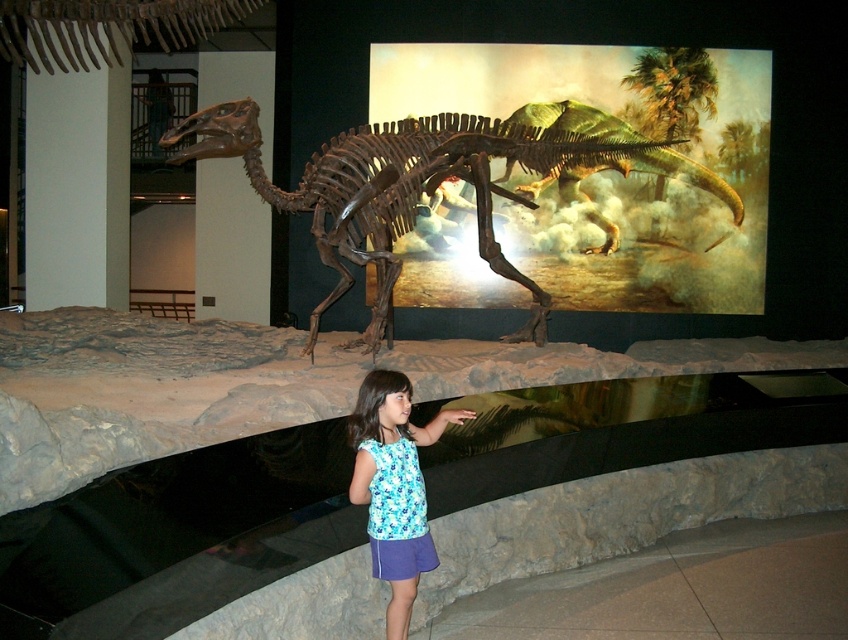
Can you confirm if brown bone at center is thinner than blue printed tank top at center?

No.

Which is below, brown bone at center or blue printed tank top at center?

blue printed tank top at center is below.

Between point (501, 124) and point (383, 388), which one is positioned behind?

Point (501, 124)

I want to click on brown bone at center, so click(424, 188).